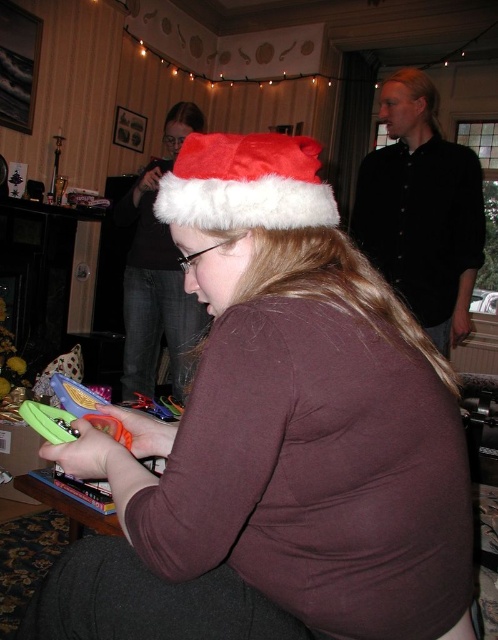
Question: Can you confirm if fuzzy white santa hat at center is positioned below fuzzy white santa hat at upper center?

Choices:
 (A) yes
 (B) no

Answer: (A)

Question: Which point appears closest to the camera in this image?

Choices:
 (A) (151, 380)
 (B) (331, 289)
 (C) (154, 198)

Answer: (B)

Question: Is matte plastic toy at center to the right of fuzzy white santa hat at upper center from the viewer's perspective?

Choices:
 (A) yes
 (B) no

Answer: (A)

Question: Which of the following is the farthest from the observer?

Choices:
 (A) [x=351, y=289]
 (B) [x=206, y=161]

Answer: (B)

Question: Among these objects, which one is nearest to the camera?

Choices:
 (A) fuzzy white santa hat at center
 (B) fuzzy white santa hat at upper center

Answer: (A)

Question: Does matte plastic toy at center appear over fuzzy white santa hat at center?

Choices:
 (A) yes
 (B) no

Answer: (B)